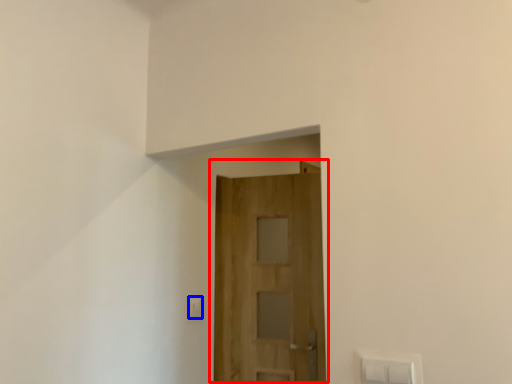
Question: Which point is closer to the camera, door (highlighted by a red box) or light switch (highlighted by a blue box)?

Choices:
 (A) door
 (B) light switch

Answer: (A)